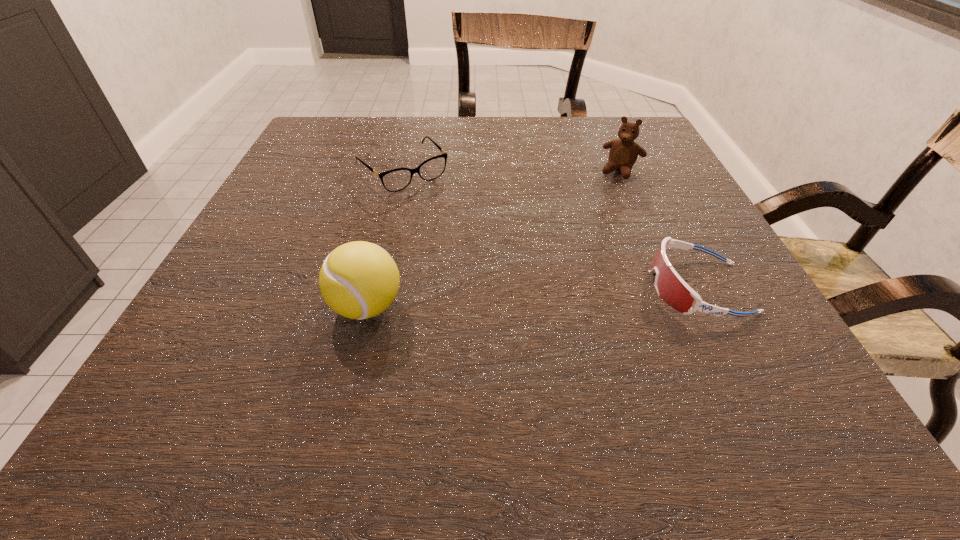
What are the coordinates of `vacant space located on the front-facing side of the spectacles` in the screenshot? It's located at (492, 260).

Identify the location of free space located 0.140m at the face of the teddy bear. The height and width of the screenshot is (540, 960). (598, 214).

Where is `vacant space situated 0.160m at the face of the teddy bear`? vacant space situated 0.160m at the face of the teddy bear is located at coordinates (595, 219).

At what (x,y) coordinates should I click in order to perform the action: click on free region located 0.240m at the face of the teddy bear. Please return your answer as a coordinate pair (x, y). This screenshot has width=960, height=540. Looking at the image, I should click on click(583, 242).

You are a GUI agent. You are given a task and a screenshot of the screen. Output one action in this format:
    pyautogui.click(x=<x>, y=<y>)
    Task: Click on the spectacles at the far edge
    The width and height of the screenshot is (960, 540).
    Given the screenshot: What is the action you would take?
    pyautogui.click(x=394, y=180)

Locate an element on the screen. teddy bear positioned at the far edge is located at coordinates (623, 154).

I want to click on object that is positioned at the near edge, so 358,280.

The image size is (960, 540). I want to click on goggles situated at the right edge, so click(x=671, y=288).

This screenshot has width=960, height=540. I want to click on teddy bear that is at the right edge, so (623, 154).

The image size is (960, 540). Find the location of `object that is at the far right corner`. object that is at the far right corner is located at coordinates (623, 154).